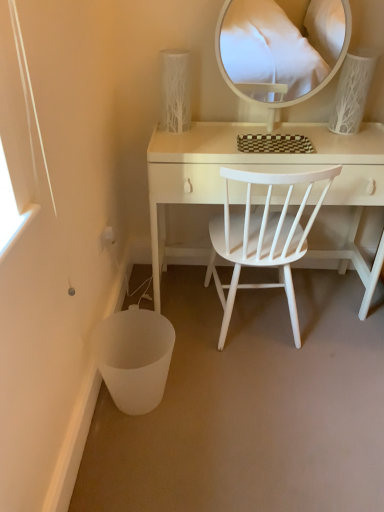
Find the location of a particular element. vacant area situated below white glossy mirror at upper center (from a real-world perspective) is located at coordinates (281, 130).